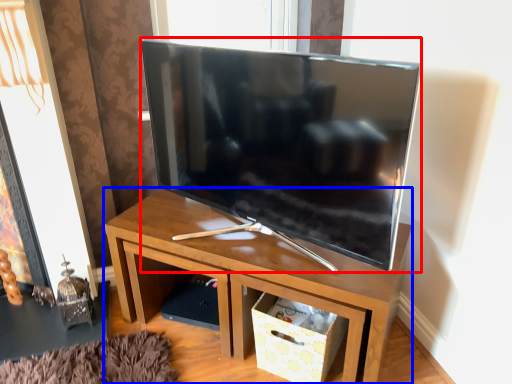
Question: Among these objects, which one is nearest to the camera, television (highlighted by a red box) or desk (highlighted by a blue box)?

Choices:
 (A) television
 (B) desk

Answer: (A)